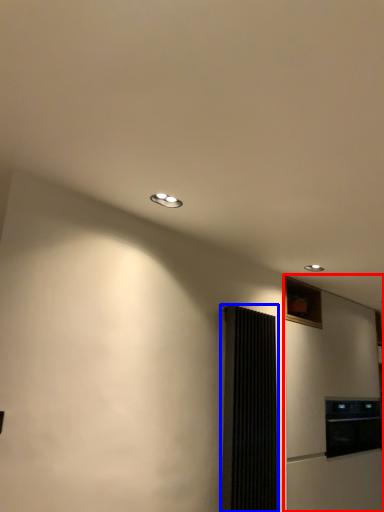
Question: Which object is further to the camera taking this photo, fridge (highlighted by a red box) or screen door (highlighted by a blue box)?

Choices:
 (A) fridge
 (B) screen door

Answer: (A)